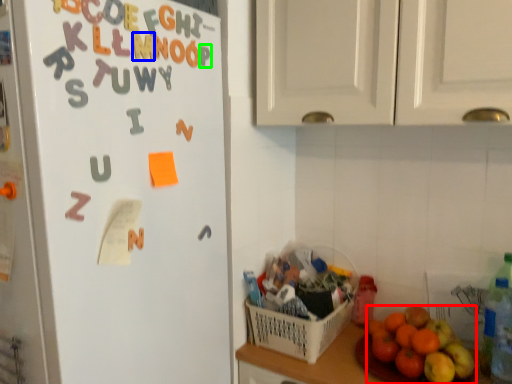
Question: Estimate the real-world distances between objects in this image. Which object is farther from grapefruit (highlighted by a red box), alphabet (highlighted by a blue box) or letter (highlighted by a green box)?

Choices:
 (A) alphabet
 (B) letter

Answer: (A)